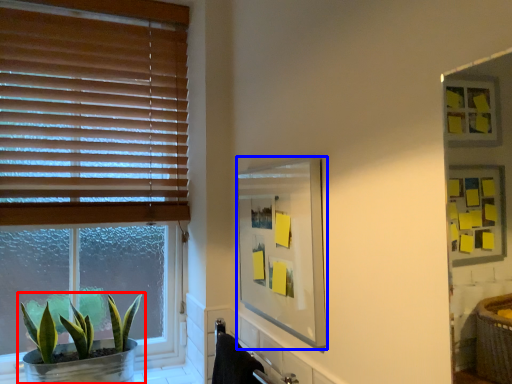
Question: Which object is further to the camera taking this photo, houseplant (highlighted by a red box) or mirror (highlighted by a blue box)?

Choices:
 (A) houseplant
 (B) mirror

Answer: (A)